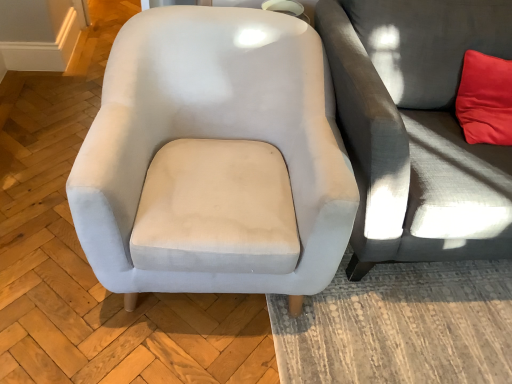
Question: Would you say satin light gray armchair at center is inside or outside gray fabric couch at right?

Choices:
 (A) outside
 (B) inside

Answer: (A)

Question: Relative to gray fabric couch at right, is satin light gray armchair at center in front or behind?

Choices:
 (A) front
 (B) behind

Answer: (A)

Question: Considering the positions of satin light gray armchair at center and gray fabric couch at right in the image, is satin light gray armchair at center taller or shorter than gray fabric couch at right?

Choices:
 (A) tall
 (B) short

Answer: (B)

Question: In the image, is gray fabric couch at right on the left side or the right side of satin light gray armchair at center?

Choices:
 (A) right
 (B) left

Answer: (A)

Question: Relative to satin light gray armchair at center, is gray fabric couch at right in front or behind?

Choices:
 (A) behind
 (B) front

Answer: (A)

Question: From the image's perspective, relative to satin light gray armchair at center, is gray fabric couch at right above or below?

Choices:
 (A) below
 (B) above

Answer: (B)

Question: Is point (353, 49) positioned closer to the camera than point (289, 147)?

Choices:
 (A) closer
 (B) farther

Answer: (A)